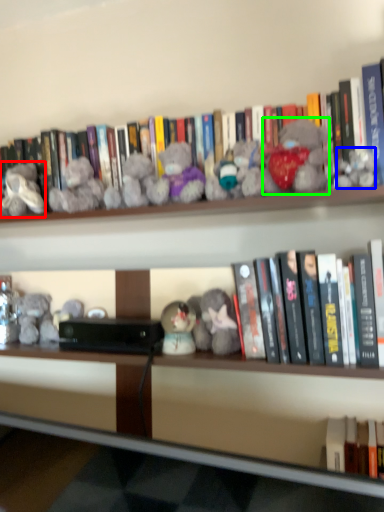
Question: Which object is the closest to the toy (highlighted by a red box)? Choose among these: toy (highlighted by a blue box) or toy (highlighted by a green box).

Choices:
 (A) toy
 (B) toy

Answer: (B)